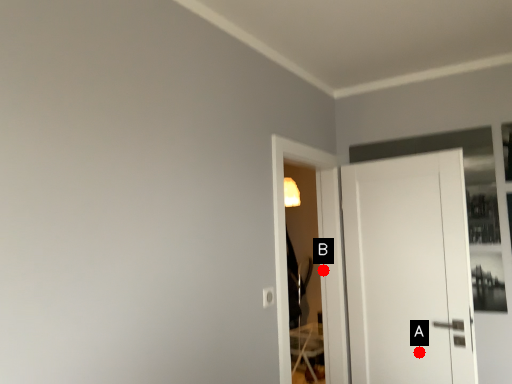
Question: Two points are circled on the image, labeled by A and B beside each circle. Among these points, which one is farthest from the camera?

Choices:
 (A) A is further
 (B) B is further

Answer: (B)